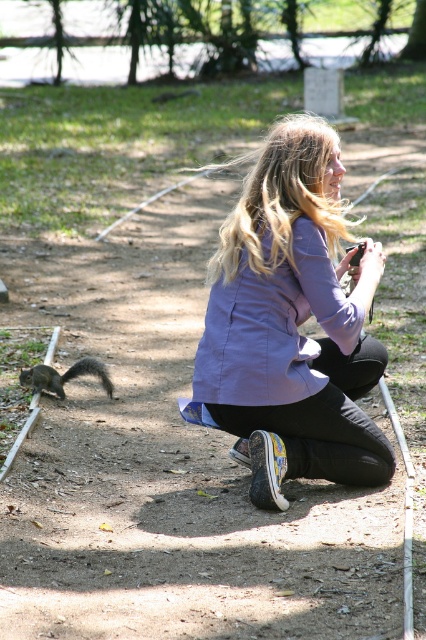
Question: Which object appears closest to the camera in this image?

Choices:
 (A) gray furry squirrel at lower left
 (B) purple matte jacket at center

Answer: (B)

Question: Which point is farther to the camera?

Choices:
 (A) (345, 346)
 (B) (37, 385)
 (C) (279, 161)

Answer: (B)

Question: Observing the image, what is the correct spatial positioning of purple matte jacket at center in reference to purple cotton jacket at center?

Choices:
 (A) right
 (B) left

Answer: (A)

Question: Can you confirm if purple matte jacket at center is bigger than gray furry squirrel at lower left?

Choices:
 (A) no
 (B) yes

Answer: (B)

Question: Among these objects, which one is nearest to the camera?

Choices:
 (A) gray furry squirrel at lower left
 (B) purple cotton jacket at center

Answer: (B)

Question: Can you confirm if purple matte jacket at center is positioned below gray furry squirrel at lower left?

Choices:
 (A) yes
 (B) no

Answer: (B)